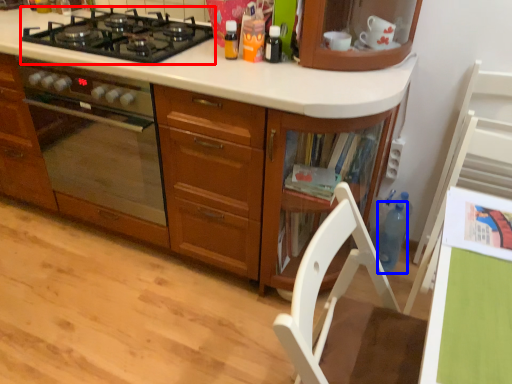
Question: Which point is further to the camera, gas stove (highlighted by a red box) or bottle (highlighted by a blue box)?

Choices:
 (A) gas stove
 (B) bottle

Answer: (B)